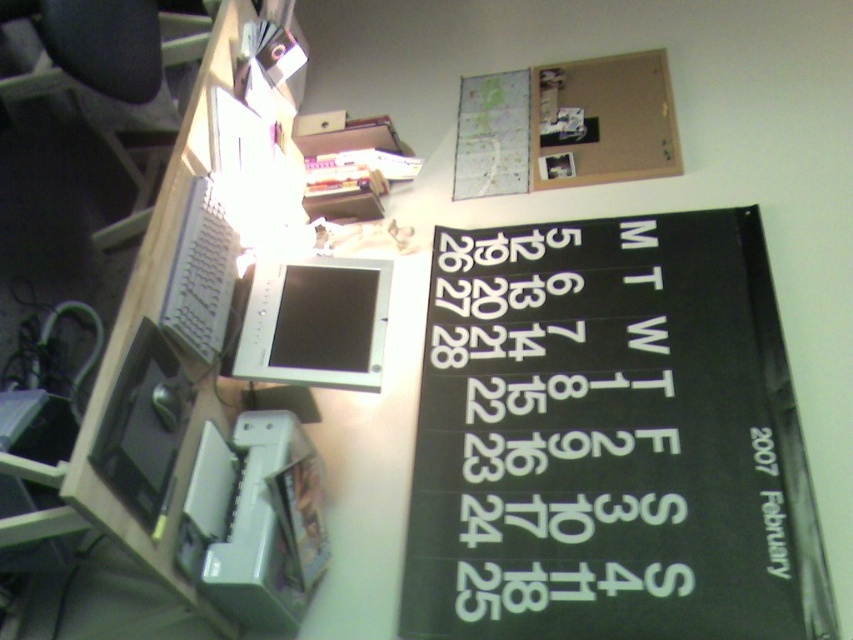
Question: Does corkboard at upper center appear over black matte drawing tablet at lower left?

Choices:
 (A) yes
 (B) no

Answer: (A)

Question: Is corkboard at upper center closer to the viewer compared to white plastic keyboard at left?

Choices:
 (A) yes
 (B) no

Answer: (B)

Question: Which point is farther from the camera taking this photo?

Choices:
 (A) (625, 122)
 (B) (222, 323)
 (C) (480, 456)
 (D) (173, 444)

Answer: (A)

Question: Estimate the real-world distances between objects in this image. Which object is closer to the corkboard at upper center?

Choices:
 (A) white plastic printer at lower center
 (B) black matte drawing tablet at lower left
 (C) white plastic calendar at right
 (D) satin silver monitor at center

Answer: (C)

Question: Which of the following is the closest to the observer?

Choices:
 (A) black matte drawing tablet at lower left
 (B) white plastic printer at lower center
 (C) corkboard at upper center

Answer: (A)

Question: Does white plastic calendar at right have a smaller size compared to satin silver monitor at center?

Choices:
 (A) yes
 (B) no

Answer: (B)